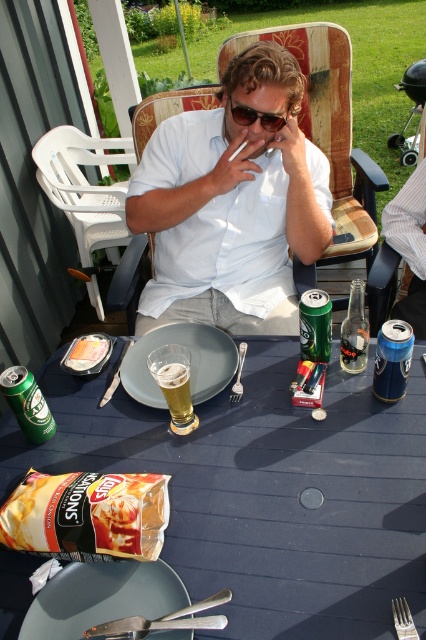
You are standing in front of the table and want to pick up the translucent glass beer at center. Is it within your reach?

The translucent glass beer at center is 3.30 feet from viewer, so yes, it is within your reach.